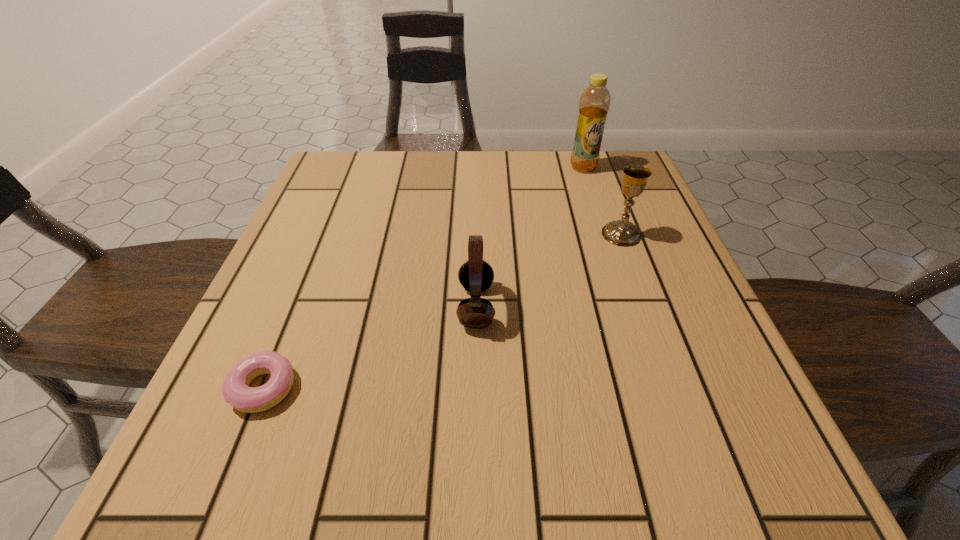
Find the location of `free space at the far right corner`. free space at the far right corner is located at coordinates (604, 196).

Image resolution: width=960 pixels, height=540 pixels. Identify the location of free space between the chalice and the farthest object. (602, 201).

Find the location of a particular element. This screenshot has width=960, height=540. vacant space in between the bottle and the chalice is located at coordinates (602, 201).

The height and width of the screenshot is (540, 960). What are the coordinates of `empty space between the third nearest object and the shortest object` in the screenshot? It's located at (443, 311).

The width and height of the screenshot is (960, 540). Identify the location of vacant space that's between the bottle and the leftmost object. (423, 278).

You are a GUI agent. You are given a task and a screenshot of the screen. Output one action in this format:
    pyautogui.click(x=<x>, y=<y>)
    Task: Click on the vacant area that lies between the second nearest object and the bottle
    The height and width of the screenshot is (540, 960).
    Given the screenshot: What is the action you would take?
    pyautogui.click(x=530, y=237)

The height and width of the screenshot is (540, 960). What are the coordinates of `unoccupied area between the headset and the shortest object` in the screenshot? It's located at (370, 347).

Where is `free spot between the second farthest object and the third object from right to left`? Image resolution: width=960 pixels, height=540 pixels. free spot between the second farthest object and the third object from right to left is located at coordinates (548, 270).

Find the location of a particular element. The width and height of the screenshot is (960, 540). empty space that is in between the second farthest object and the tallest object is located at coordinates (602, 201).

The height and width of the screenshot is (540, 960). What are the coordinates of `free space between the headset and the leftmost object` in the screenshot? It's located at click(x=370, y=347).